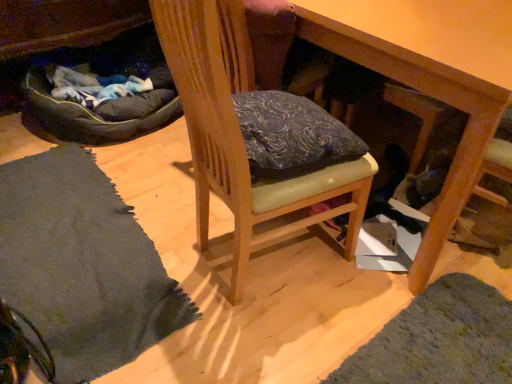
Where is `free space in front of wooden chair at center`? free space in front of wooden chair at center is located at coordinates (279, 340).